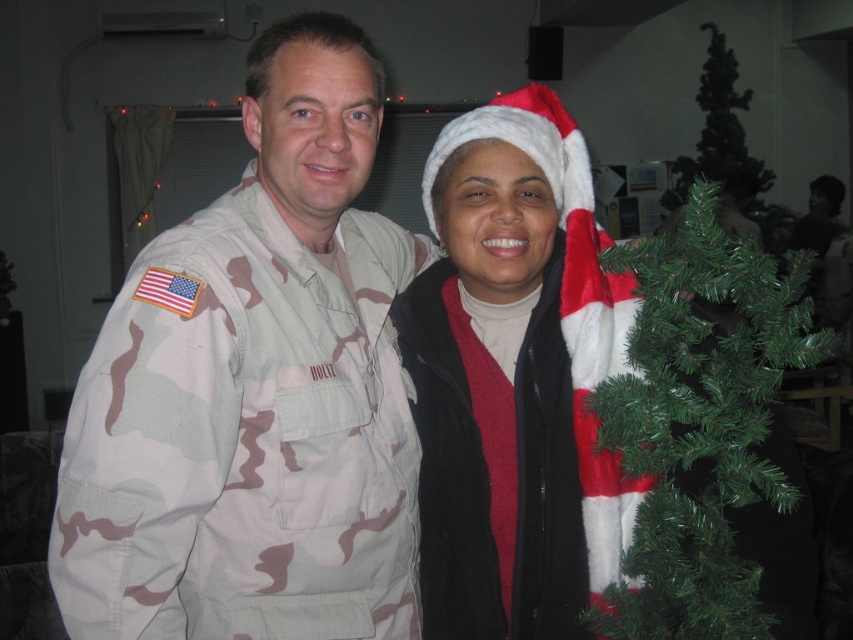
You are organizing a holiday photo shoot and need to ensure proper spacing between the camo uniform at left and the green artificial christmas tree at right. According to the scene description, which object is located to the left of the other?

The camo uniform at left is positioned on the left side of the green artificial christmas tree at right.

You are organizing a holiday photo shoot and need to ensure that the white fuzzy santa hat at center and the green artificial christmas tree at right are both visible in the frame. Given their sizes, which object should you prioritize positioning closer to the camera to ensure both are clearly visible?

The white fuzzy santa hat at center should be positioned closer to the camera because it occupies less space than the green artificial christmas tree at right, making it smaller in the frame and harder to see from a distance.